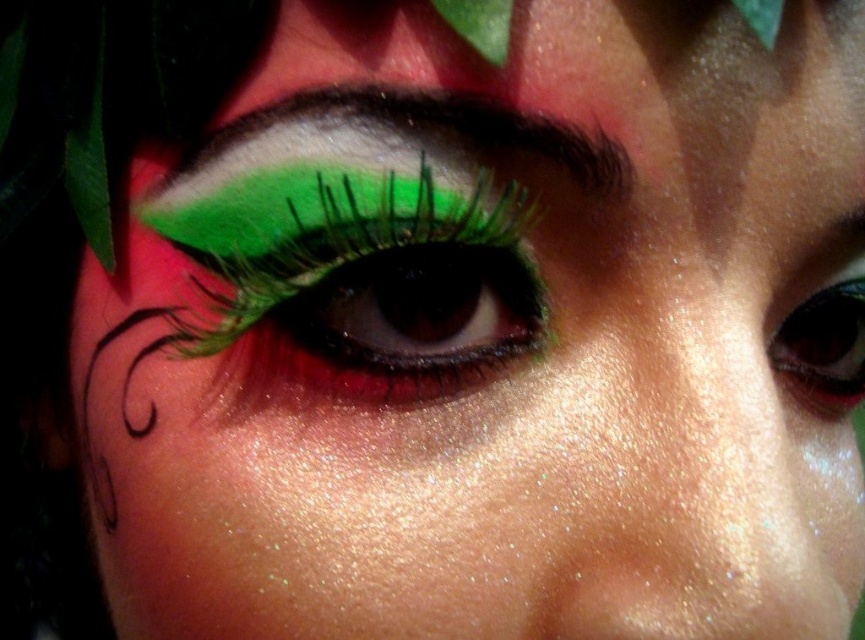
You are a makeup artist trying to replicate this eye look. You need to apply the green matte eyeliner at center before the shiny black eye at center. Is this the correct order?

Yes, since the green matte eyeliner at center is located above the shiny black eye at center, applying it first would ensure proper placement without smudging the shiny black eye at center.

You are a makeup artist assessing the eye makeup. You need to determine if the green matte eyeliner at center will cover the dark brown eyebrow at upper center if you move it upward. Can you confirm?

The green matte eyeliner at center has a greater height compared to the dark brown eyebrow at upper center. Therefore, moving it upward might cause it to cover part of the eyebrow since it is taller.

You are a makeup artist trying to replicate this eye look. You have both the green matte eyeliner at center and the shiny black eye at center. Which one should you apply first to ensure proper layering?

The green matte eyeliner at center should be applied first because it is taller than the shiny black eye at center, allowing the black eye makeup to be placed over or under appropriately.